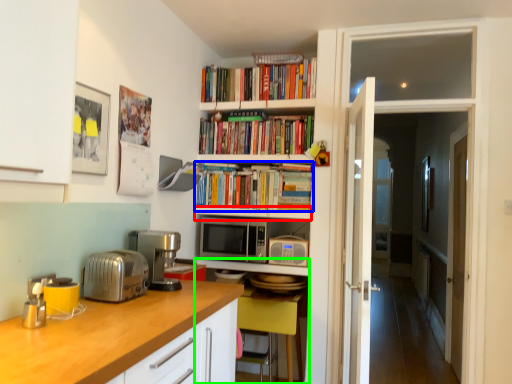
Question: Estimate the real-world distances between objects in this image. Which object is farther from shelf (highlighted by a red box), book (highlighted by a blue box) or computer desk (highlighted by a green box)?

Choices:
 (A) book
 (B) computer desk

Answer: (B)